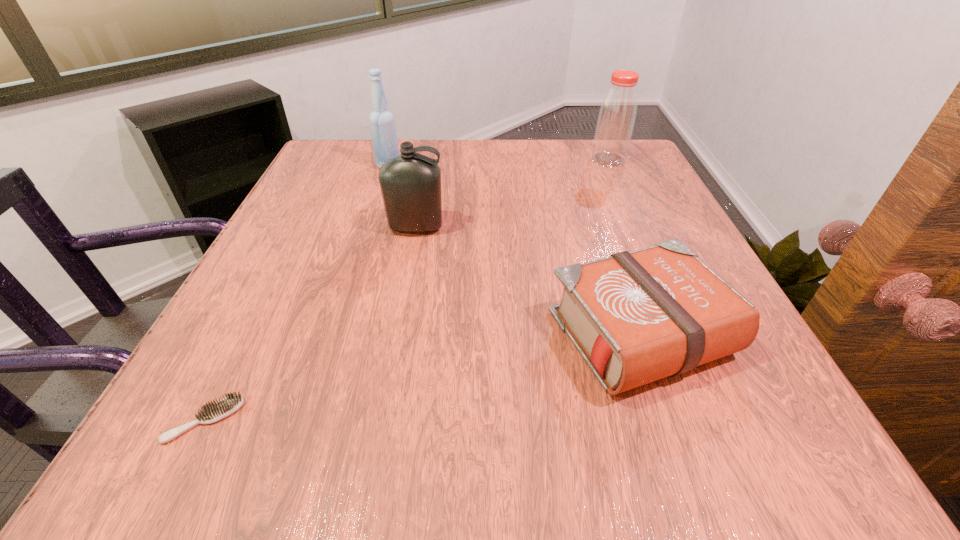
You are a GUI agent. You are given a task and a screenshot of the screen. Output one action in this format:
    pyautogui.click(x=<x>, y=<y>)
    Task: Click on the vacant area between the Bible and the rightmost bottle
    The height and width of the screenshot is (540, 960).
    Given the screenshot: What is the action you would take?
    pyautogui.click(x=624, y=247)

Find the location of a particular element. vacant region between the leftmost bottle and the rightmost bottle is located at coordinates (498, 163).

Image resolution: width=960 pixels, height=540 pixels. Find the location of `vacant area that lies between the leftmost bottle and the shortest object`. vacant area that lies between the leftmost bottle and the shortest object is located at coordinates (297, 293).

Where is `vacant space that's between the rightmost bottle and the second shortest object`? vacant space that's between the rightmost bottle and the second shortest object is located at coordinates (624, 247).

Where is `free space between the rightmost bottle and the Bible`? The width and height of the screenshot is (960, 540). free space between the rightmost bottle and the Bible is located at coordinates (624, 247).

Where is `empty space that is in between the rightmost bottle and the scrubbing brush`? The width and height of the screenshot is (960, 540). empty space that is in between the rightmost bottle and the scrubbing brush is located at coordinates (406, 290).

The image size is (960, 540). I want to click on object that can be found as the third closest to the leftmost bottle, so click(x=635, y=317).

Point out which object is positioned as the fourth nearest to the shortest object. Please provide its 2D coordinates. Your answer should be formatted as a tuple, i.e. [(x, y)], where the tuple contains the x and y coordinates of a point satisfying the conditions above.

[(617, 114)]

Point out which bottle is positioned as the nearest to the shortest bottle. Please provide its 2D coordinates. Your answer should be formatted as a tuple, i.e. [(x, y)], where the tuple contains the x and y coordinates of a point satisfying the conditions above.

[(382, 123)]

Select which bottle appears as the closest to the third tallest object. Please provide its 2D coordinates. Your answer should be formatted as a tuple, i.e. [(x, y)], where the tuple contains the x and y coordinates of a point satisfying the conditions above.

[(382, 123)]